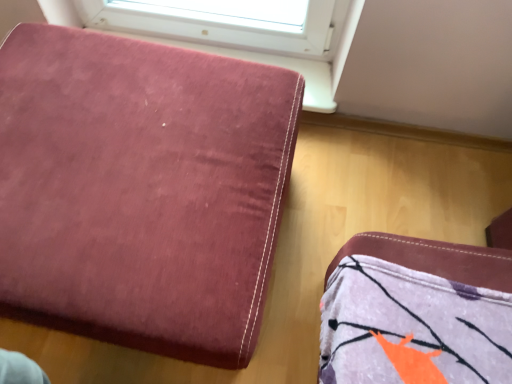
Identify the location of free spot above velvet-like burgundy ottoman at upper left (from a real-world perspective). This screenshot has height=384, width=512. (127, 150).